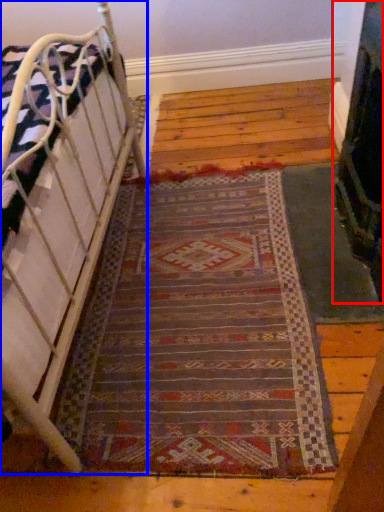
Question: Which object appears closest to the camera in this image, fireplace (highlighted by a red box) or furniture (highlighted by a blue box)?

Choices:
 (A) fireplace
 (B) furniture

Answer: (B)